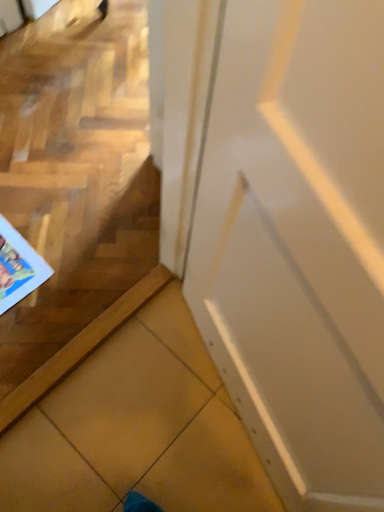
Locate an element on the screen. This screenshot has height=512, width=384. vacant region to the right of matte paper comic book at lower left is located at coordinates (72, 271).